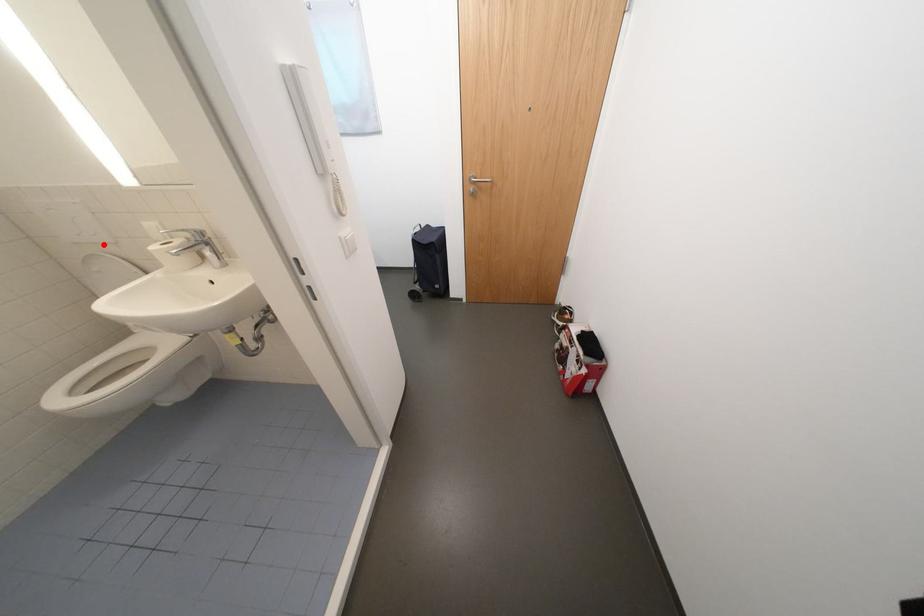
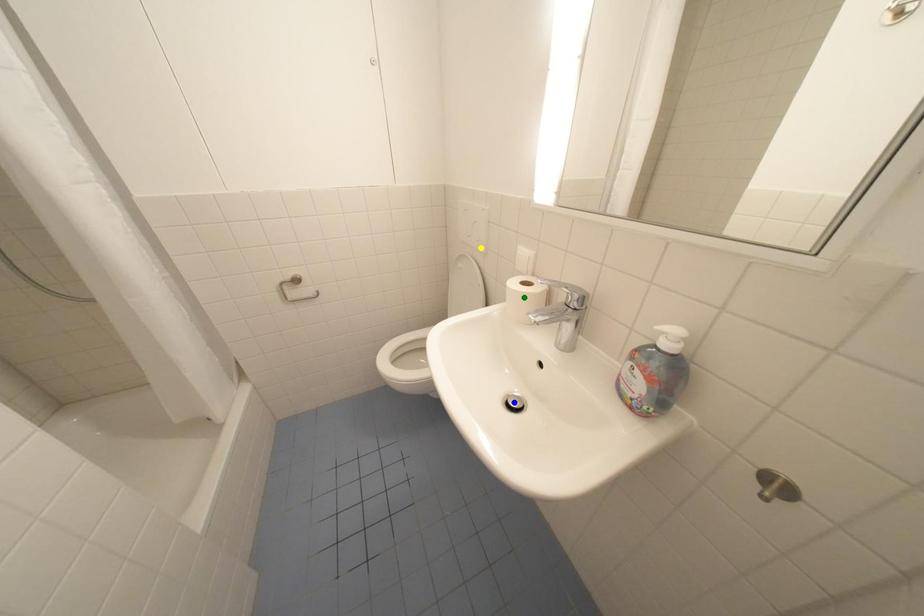
Question: I am providing you with two images of the same scene from different viewpoints. A red point is marked on the first image. You are given multiple points on the second image. In image 2, which mark is for the same physical point as the one in image 1?

Choices:
 (A) blue point
 (B) yellow point
 (C) green point

Answer: (B)